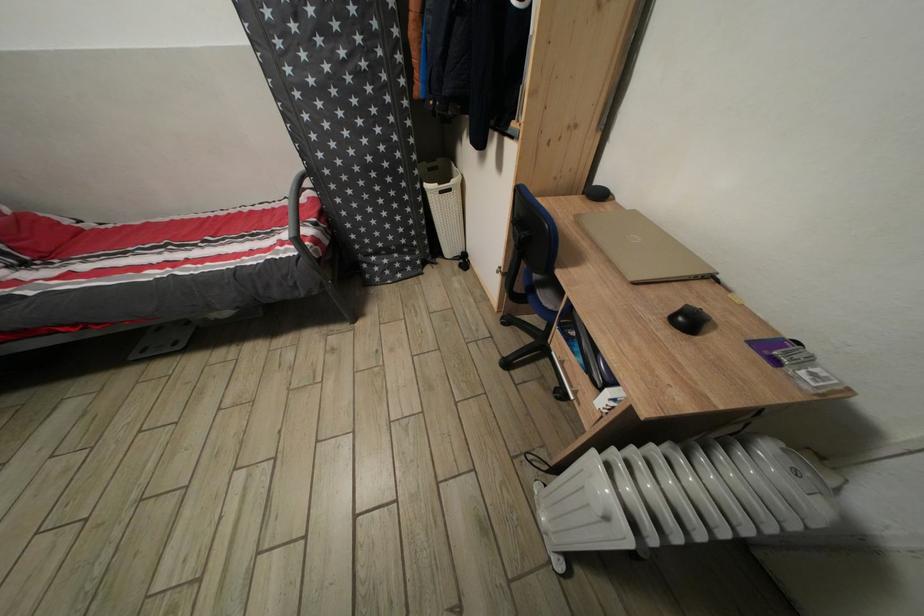
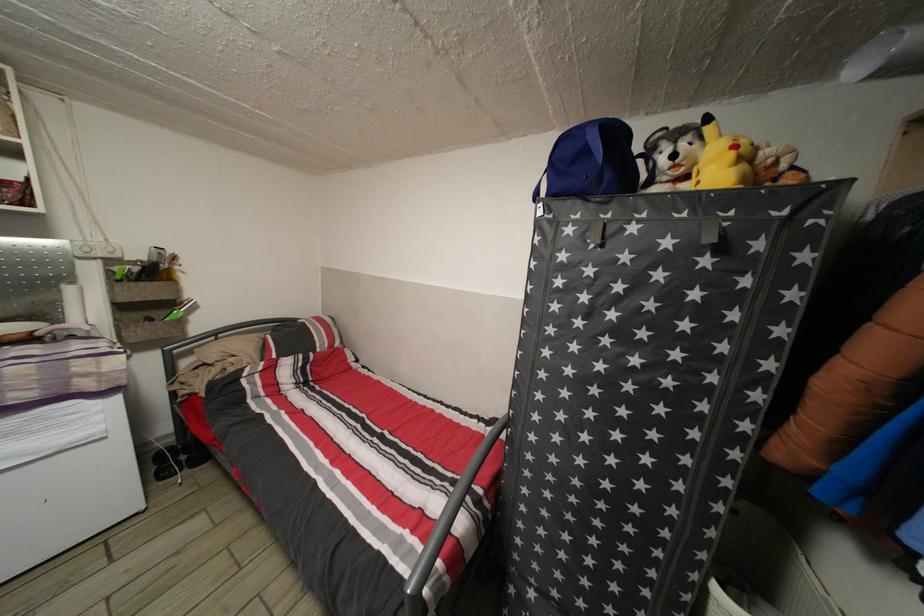
First-person continuous shooting, in which direction is the camera rotating?

The rotation direction of the camera is left-up.